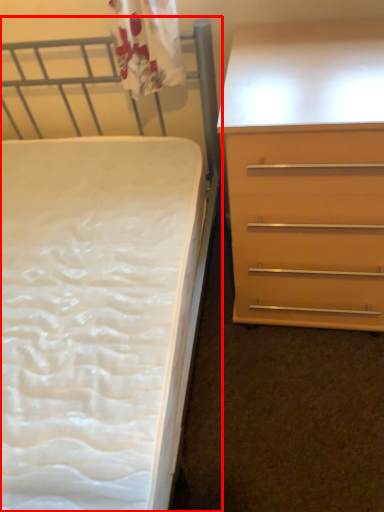
Question: From the image's perspective, what is the correct spatial positioning of bed (annotated by the red box) in reference to chest of drawers?

Choices:
 (A) below
 (B) above

Answer: (A)